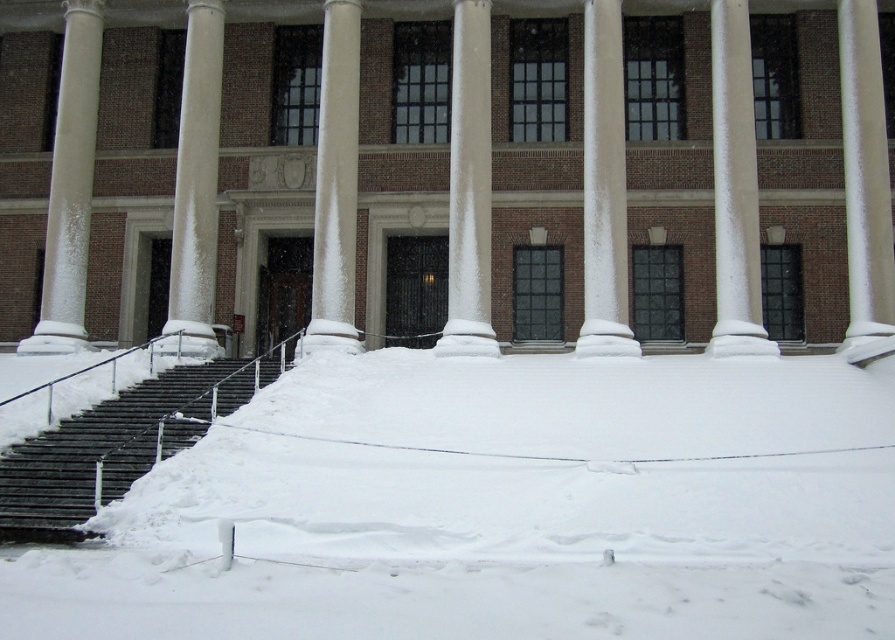
You are standing in front of the grand building and want to walk towards the entrance steps. Which object, the white fluffy snow at lower center or the white frosty column at left, is closer to your current position?

The white fluffy snow at lower center is closer to your current position because it is located to the right of the white frosty column at left, meaning it is positioned nearer to the viewer.

You are standing in front of the grand building and notice two points marked on the snowy ground. The first point is at coordinate point(729,248) and the second is at point(587,80). Which point is closer to your current position?

Point(729,248) is closer to the camera than point(587,80), so the first point is closer to your current position.

In the scene shown: You are standing in front of the grand building and want to take a photo of the columns without any snow in the foreground. Based on your current position, where should you move to ensure the white fluffy snow at lower center is out of the frame?

Move to the left or right so that the white fluffy snow at lower center is no longer in the center area of your view. Since the snow is located at point 0.792 on the x and 0.563 on the y coordinate, shifting your position horizontally would help exclude it from the frame.